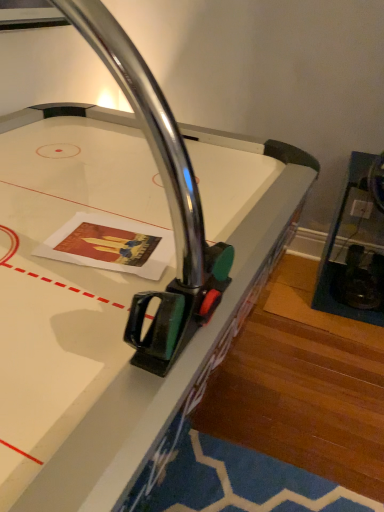
Question: In terms of width, does metallic glass shelf at right look wider or thinner when compared to metallic air hockey table at center?

Choices:
 (A) thin
 (B) wide

Answer: (A)

Question: Is point (357, 275) closer or farther from the camera than point (18, 293)?

Choices:
 (A) farther
 (B) closer

Answer: (A)

Question: From the image's perspective, is metallic glass shelf at right positioned above or below metallic air hockey table at center?

Choices:
 (A) below
 (B) above

Answer: (B)

Question: Choose the correct answer: Is metallic air hockey table at center inside metallic glass shelf at right or outside it?

Choices:
 (A) inside
 (B) outside

Answer: (B)

Question: From the image's perspective, is metallic air hockey table at center above or below metallic glass shelf at right?

Choices:
 (A) below
 (B) above

Answer: (A)

Question: Is point (135, 138) positioned closer to the camera than point (349, 161)?

Choices:
 (A) closer
 (B) farther

Answer: (A)

Question: Looking at their shapes, would you say metallic air hockey table at center is wider or thinner than metallic glass shelf at right?

Choices:
 (A) thin
 (B) wide

Answer: (B)